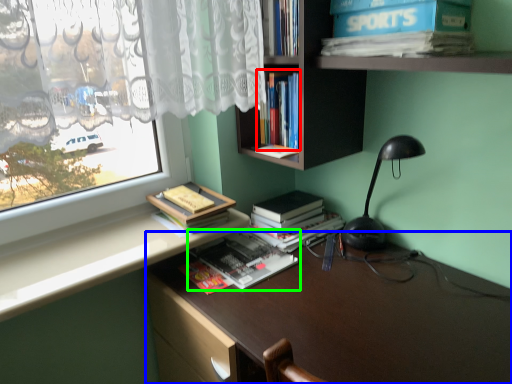
Question: Based on their relative distances, which object is nearer to book (highlighted by a red box)? Choose from desk (highlighted by a blue box) and book (highlighted by a green box).

Choices:
 (A) desk
 (B) book

Answer: (B)